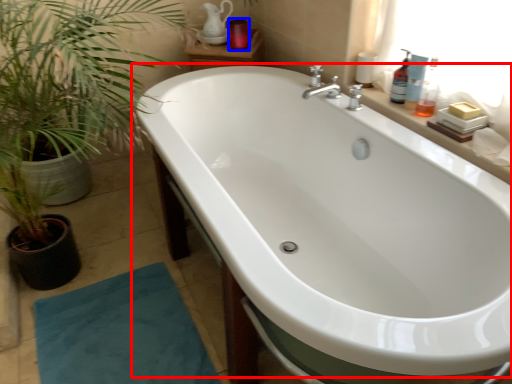
Question: Which object appears closest to the camera in this image, bathtub (highlighted by a red box) or toiletry (highlighted by a blue box)?

Choices:
 (A) bathtub
 (B) toiletry

Answer: (A)